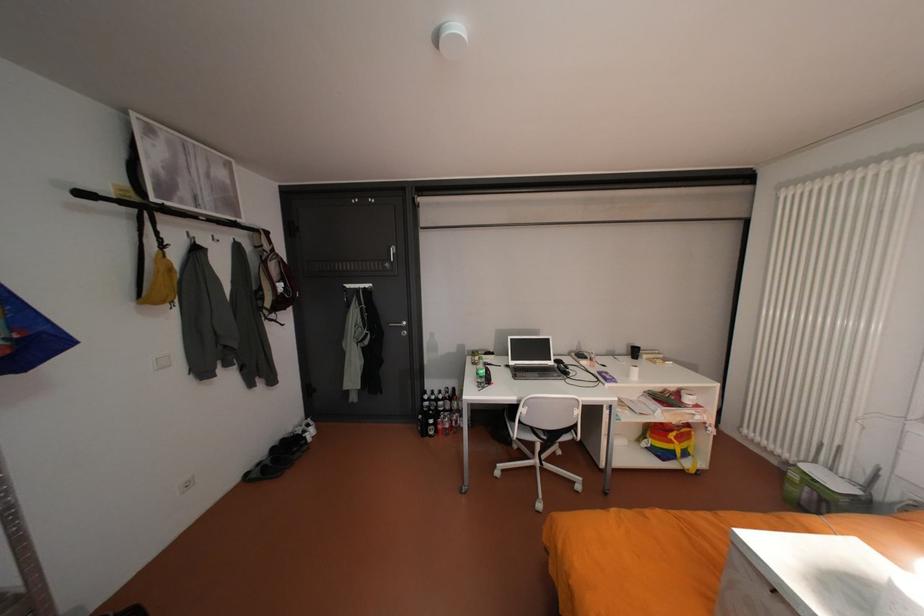
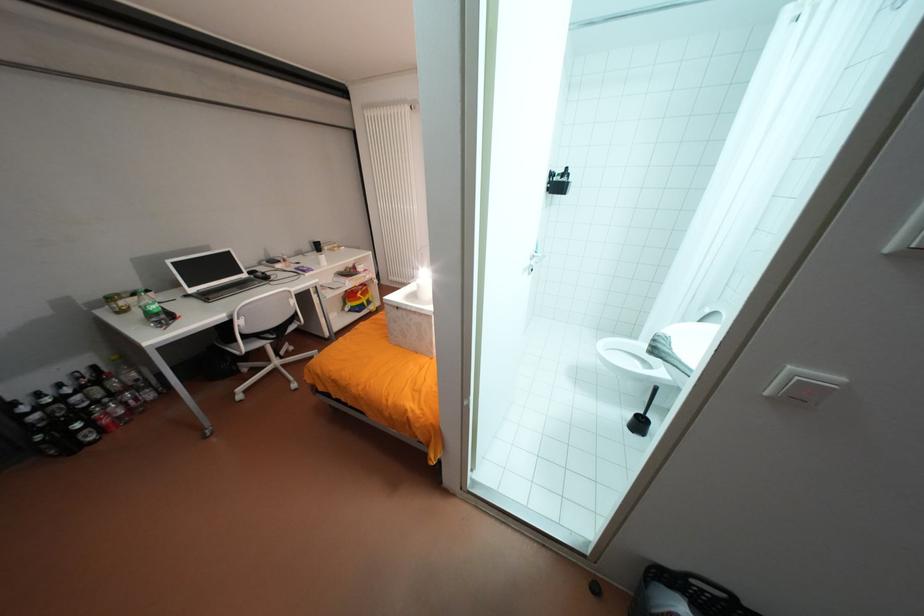
The point at (440, 419) is marked in the first image. Where is the corresponding point in the second image?

(88, 424)